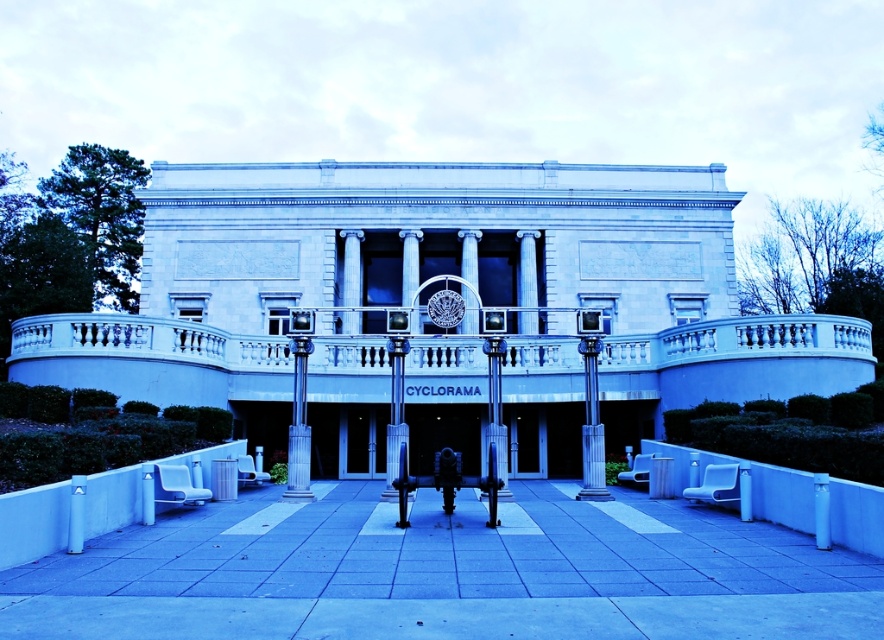
Can you confirm if smooth concrete pavement at center is bigger than slate gray stone column at center?

Correct, smooth concrete pavement at center is larger in size than slate gray stone column at center.

What do you see at coordinates (447, 572) in the screenshot? Image resolution: width=884 pixels, height=640 pixels. I see `smooth concrete pavement at center` at bounding box center [447, 572].

Image resolution: width=884 pixels, height=640 pixels. Find the location of `smooth concrete pavement at center`. smooth concrete pavement at center is located at coordinates (447, 572).

Between slate gray stone column at center and smooth white pillar at lower left, which one is positioned lower?

smooth white pillar at lower left is below.

Is point (299, 381) in front of point (79, 477)?

No, (299, 381) is behind (79, 477).

Measure the distance between point (299, 496) and camera.

Point (299, 496) and camera are 154.63 feet apart from each other.

Find the location of `slate gray stone column at center`. slate gray stone column at center is located at coordinates (299, 426).

Does point (132, 620) lie in front of point (399, 380)?

Yes, point (132, 620) is in front of point (399, 380).

Identify the location of smooth concrete pavement at center. (447, 572).

Is point (867, 621) farther from viewer compared to point (398, 461)?

No, (867, 621) is closer to viewer.

The image size is (884, 640). In order to click on smooth concrete pavement at center in this screenshot , I will do `click(447, 572)`.